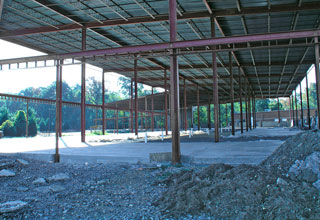
You are a GUI agent. You are given a task and a screenshot of the screen. Output one action in this format:
    pyautogui.click(x=<x>, y=<y>)
    Task: Click on the beam
    
    Given the screenshot: What is the action you would take?
    pyautogui.click(x=173, y=45)